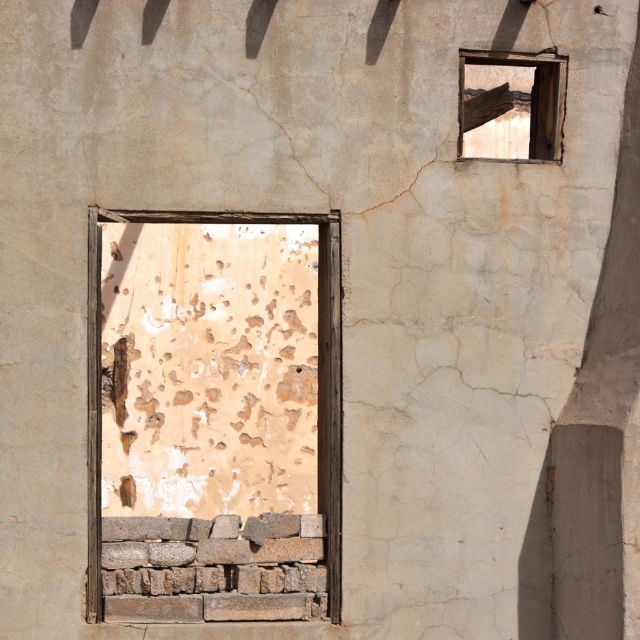
Question: Is brown wooden window frame at center thinner than wooden frame at upper right?

Choices:
 (A) yes
 (B) no

Answer: (A)

Question: Which point is farther to the camera?

Choices:
 (A) (504, 77)
 (B) (273, 536)

Answer: (A)

Question: Which point appears closest to the camera in this image?

Choices:
 (A) (506, 132)
 (B) (317, 314)

Answer: (B)

Question: Can you confirm if brown wooden window frame at center is thinner than wooden frame at upper right?

Choices:
 (A) yes
 (B) no

Answer: (A)

Question: Which point is farther from the camera taking this photo?

Choices:
 (A) (538, 116)
 (B) (264, 257)

Answer: (B)

Question: Can you confirm if brown wooden window frame at center is positioned to the right of wooden frame at upper right?

Choices:
 (A) no
 (B) yes

Answer: (A)